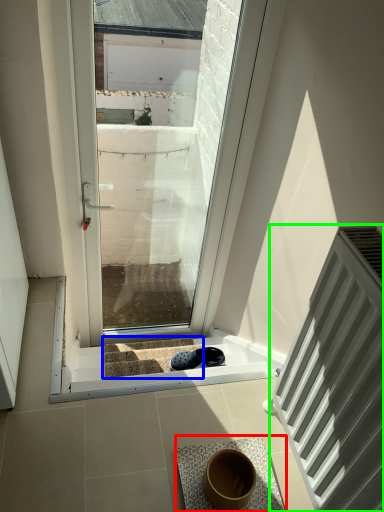
Question: Estimate the real-world distances between objects in this image. Which object is closer to bath mat (highlighted by a red box), stairwell (highlighted by a blue box) or radiator (highlighted by a green box)?

Choices:
 (A) stairwell
 (B) radiator

Answer: (B)